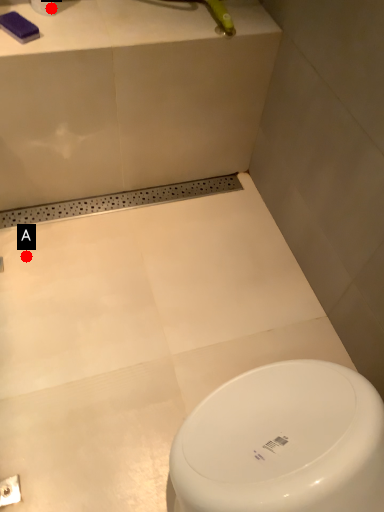
Question: Two points are circled on the image, labeled by A and B beside each circle. Which point appears closest to the camera in this image?

Choices:
 (A) A is closer
 (B) B is closer

Answer: (B)